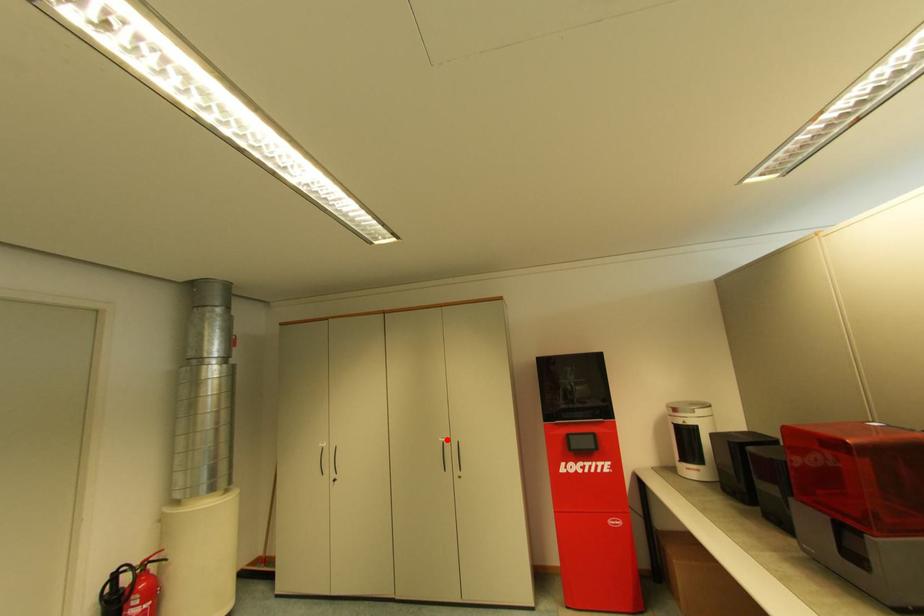
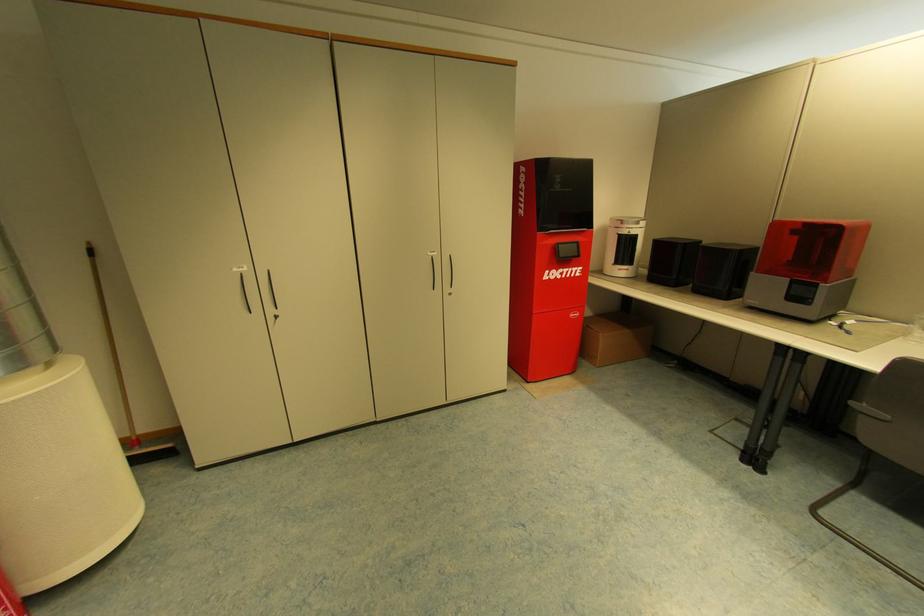
Locate, in the second image, the point that corresponds to the highlighted location in the first image.

(436, 254)